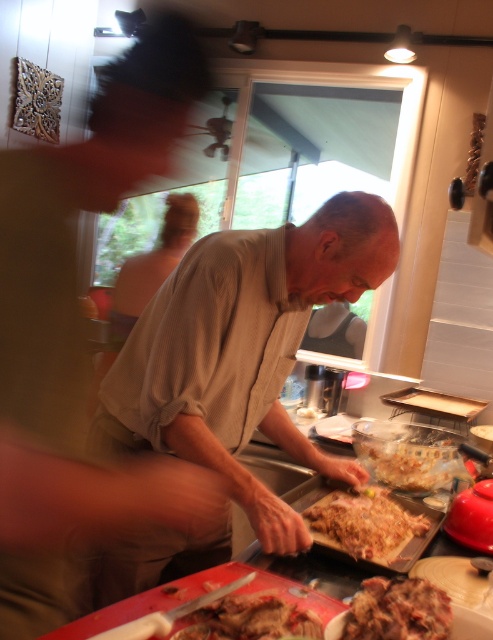
Is brown crispy skin at center positioned at the back of meaty brown meat at center?

Yes.

Between brown crispy skin at center and meaty brown meat at center, which one is positioned higher?

brown crispy skin at center is higher up.

The image size is (493, 640). Describe the element at coordinates (365, 524) in the screenshot. I see `brown crispy skin at center` at that location.

The height and width of the screenshot is (640, 493). Identify the location of brown crispy skin at center. (365, 524).

Is point (205, 292) farther from camera compared to point (255, 609)?

Yes, it is.

Is point (287, 326) positioned in front of point (240, 596)?

No, it is not.

Find the location of a particular element. This screenshot has height=640, width=493. light beige shirt at center is located at coordinates (243, 349).

Can you confirm if brown crispy skin at center is positioned below brown meat at center?

Indeed, brown crispy skin at center is positioned under brown meat at center.

Is point (401, 513) positioned in front of point (445, 602)?

No, (401, 513) is further to viewer.

Is point (372, 548) in front of point (371, 611)?

No, (372, 548) is further to viewer.

I want to click on brown crispy skin at center, so click(x=365, y=524).